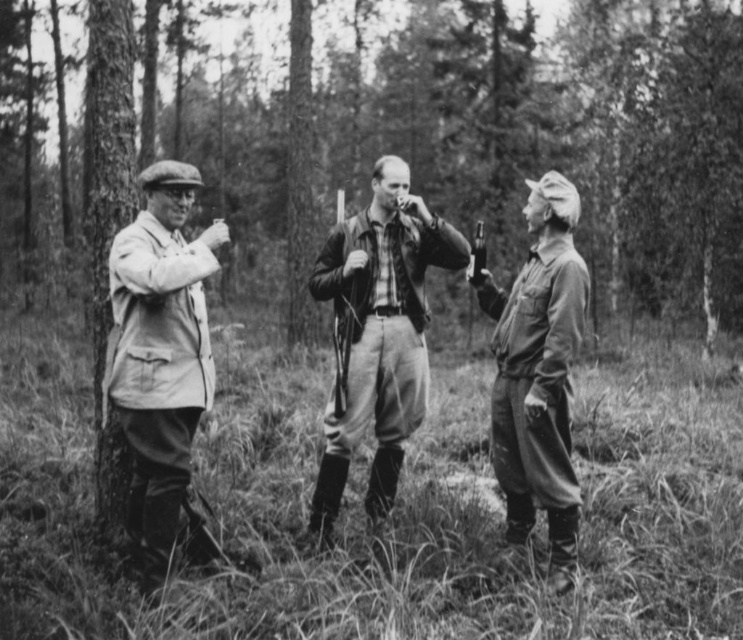
From the picture: Based on the scene described, which object is taller between the smooth bark tree at center and the leather jacket at center?

The smooth bark tree at center is much taller than the leather jacket at center.

In the scene shown: Based on the scene described, which object is taller between the smooth bark tree at center and the light beige fabric coat at left?

The smooth bark tree at center is taller than the light beige fabric coat at left.